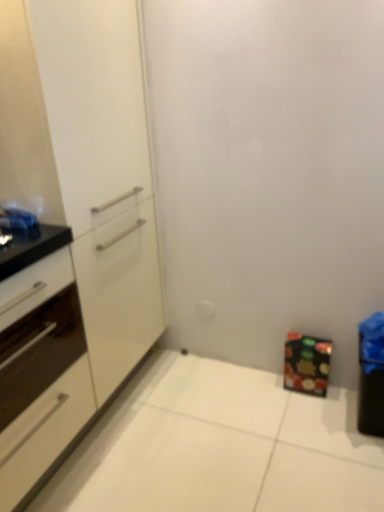
Question: In terms of size, does matte black cabinet at lower right, the first cabinetry viewed from the right, appear bigger or smaller than white glossy cabinet at left, marked as the 2th cabinetry in a left-to-right arrangement?

Choices:
 (A) big
 (B) small

Answer: (B)

Question: Considering the positions of point (297, 382) and point (3, 474), is point (297, 382) closer or farther from the camera than point (3, 474)?

Choices:
 (A) closer
 (B) farther

Answer: (B)

Question: Estimate the real-world distances between objects in this image. Which object is farther from the matte black cabinet at lower right, which appears as the 3th cabinetry when viewed from the left?

Choices:
 (A) white glossy cabinet at left, marked as the 2th cabinetry in a left-to-right arrangement
 (B) white glossy cabinet at left, marked as the 1th cabinetry in a left-to-right arrangement

Answer: (B)

Question: Which object is the closest to the white glossy cabinet at left, marked as the 2th cabinetry in a left-to-right arrangement?

Choices:
 (A) white glossy cabinet at left, marked as the 1th cabinetry in a left-to-right arrangement
 (B) matte black cabinet at lower right, the first cabinetry viewed from the right

Answer: (A)